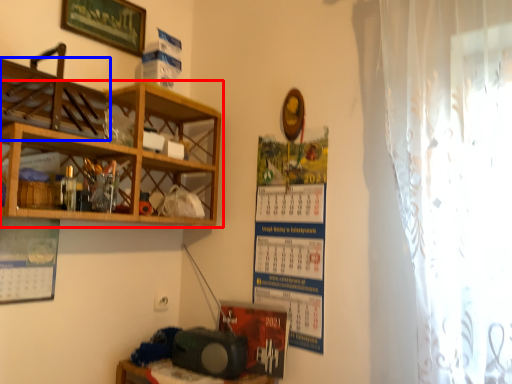
Question: Which object is further to the camera taking this photo, shelf (highlighted by a red box) or shelf (highlighted by a blue box)?

Choices:
 (A) shelf
 (B) shelf

Answer: (A)